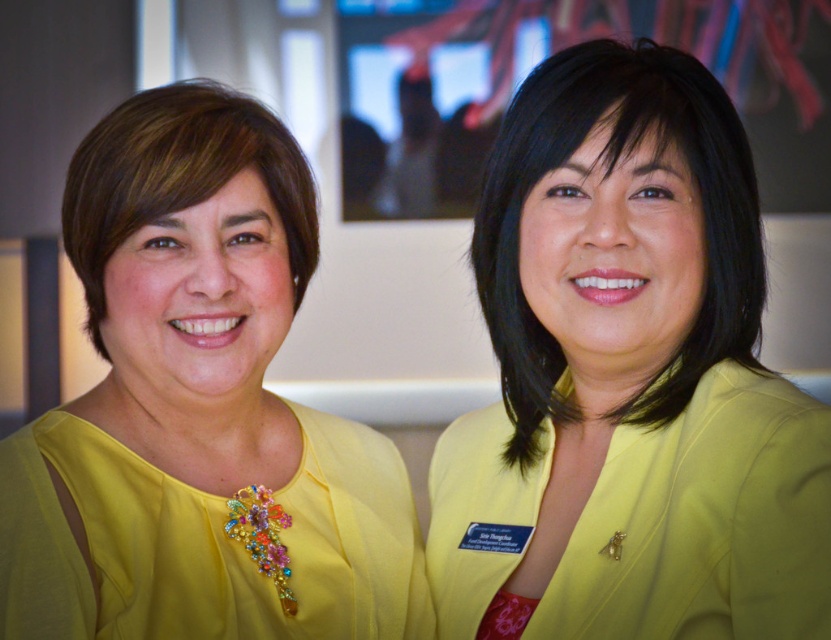
Does matte yellow blazer at center have a greater height compared to yellow satin blouse at left?

Indeed, matte yellow blazer at center has a greater height compared to yellow satin blouse at left.

From the picture: Measure the distance between matte yellow blazer at center and camera.

They are 1.13 meters apart.

Does point (465, 547) come closer to viewer compared to point (111, 515)?

No, it is not.

Where is `matte yellow blazer at center`? The width and height of the screenshot is (831, 640). matte yellow blazer at center is located at coordinates (627, 378).